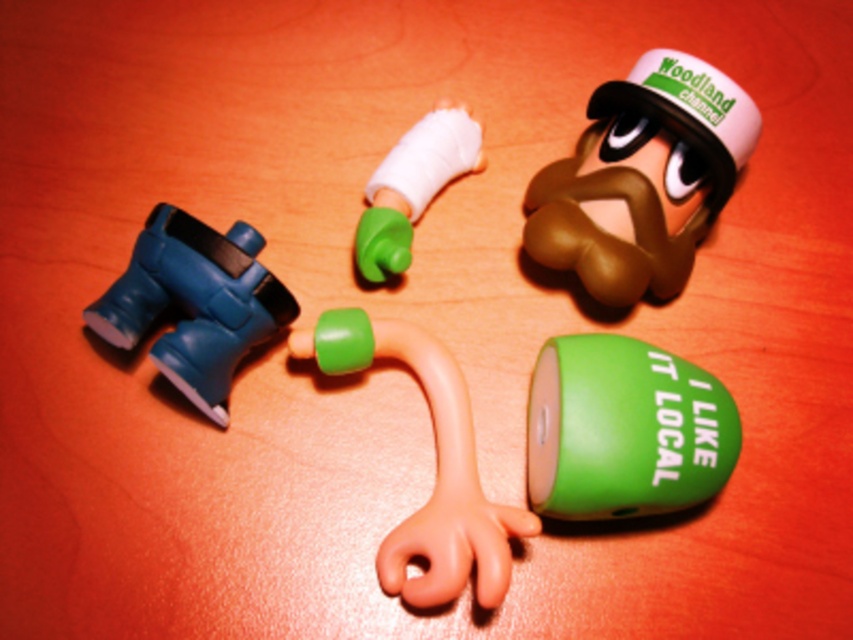
Please check the coordinates of the rubber hand at center. Is it located at point [445,492]?

Yes, the rubber hand at center is located at point [445,492].

You are standing at the center of the wooden surface and want to place a small sticker at the point marked by the coordinates point (624, 429). Which object should you place the sticker on?

The point (624, 429) is located on the green matte speaker at lower right, so you should place the sticker on the green matte speaker at lower right.

You are organizing a first aid kit and need to place the green matte speaker at lower right and the green matte bandage at center. Which item should you place first based on their positions in the image?

The green matte bandage at center should be placed first since the green matte speaker at lower right is located below it, indicating it is positioned lower and might be beneath the bandage in the arrangement.